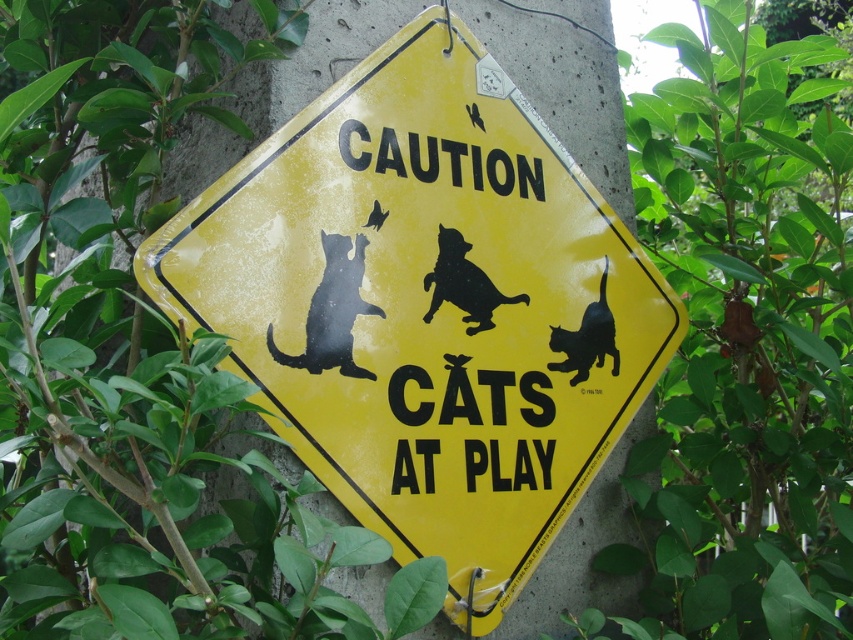
Question: Which object is positioned farthest from the yellow plastic sign at center?

Choices:
 (A) black matte cat at center
 (B) black matte cat at upper center

Answer: (B)

Question: Does black matte cat at center appear under black matte cat at lower right?

Choices:
 (A) no
 (B) yes

Answer: (A)

Question: Which of the following is the closest to the observer?

Choices:
 (A) black matte cat at lower right
 (B) yellow plastic sign at center
 (C) black matte cat at upper center
 (D) black matte cat at center

Answer: (B)

Question: Does yellow plastic sign at center appear on the right side of black matte cat at center?

Choices:
 (A) yes
 (B) no

Answer: (B)

Question: Does black matte cat at upper center appear under black matte cat at lower right?

Choices:
 (A) yes
 (B) no

Answer: (B)

Question: Among these objects, which one is farthest from the camera?

Choices:
 (A) black matte cat at upper center
 (B) black matte cat at lower right
 (C) black matte cat at center
 (D) yellow plastic sign at center

Answer: (B)